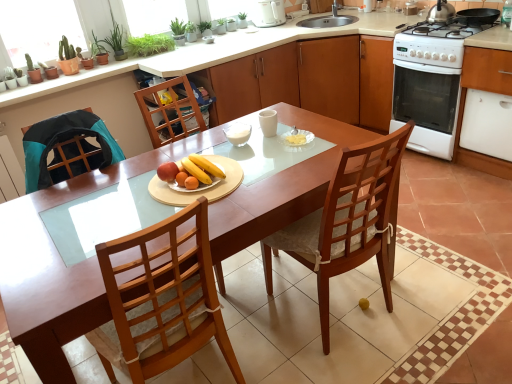
Where is `free point in front of yellow matte bananas at center, the first fruit dish from the right`? The height and width of the screenshot is (384, 512). free point in front of yellow matte bananas at center, the first fruit dish from the right is located at coordinates (188, 202).